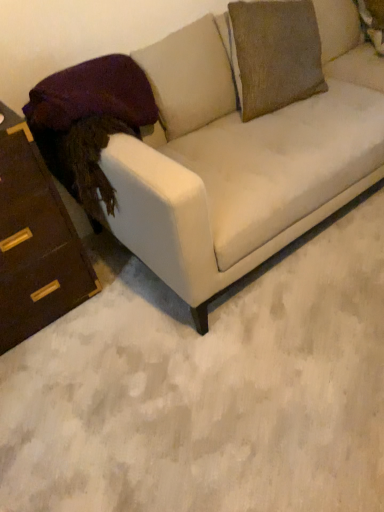
Question: Is velvet purple pillow at left facing towards matte white couch at center?

Choices:
 (A) yes
 (B) no

Answer: (A)

Question: Is velvet purple pillow at left further to the viewer compared to matte white couch at center?

Choices:
 (A) no
 (B) yes

Answer: (B)

Question: Is the surface of velvet purple pillow at left in direct contact with matte white couch at center?

Choices:
 (A) yes
 (B) no

Answer: (B)

Question: Can matte white couch at center be found inside velvet purple pillow at left?

Choices:
 (A) no
 (B) yes

Answer: (A)

Question: Considering the relative sizes of velvet purple pillow at left and matte white couch at center in the image provided, is velvet purple pillow at left thinner than matte white couch at center?

Choices:
 (A) yes
 (B) no

Answer: (A)

Question: Is brown wood chest of drawers at left inside the boundaries of matte white couch at center, or outside?

Choices:
 (A) outside
 (B) inside

Answer: (A)

Question: Considering the positions of brown wood chest of drawers at left and matte white couch at center in the image, is brown wood chest of drawers at left bigger or smaller than matte white couch at center?

Choices:
 (A) big
 (B) small

Answer: (B)

Question: Is point (36, 249) positioned closer to the camera than point (192, 233)?

Choices:
 (A) closer
 (B) farther

Answer: (B)

Question: Visually, is brown wood chest of drawers at left positioned to the left or to the right of matte white couch at center?

Choices:
 (A) right
 (B) left

Answer: (B)

Question: From their relative heights in the image, would you say velvet purple pillow at left is taller or shorter than brown wood chest of drawers at left?

Choices:
 (A) short
 (B) tall

Answer: (A)

Question: In the image, is velvet purple pillow at left positioned in front of or behind brown wood chest of drawers at left?

Choices:
 (A) behind
 (B) front

Answer: (A)

Question: From a real-world perspective, relative to brown wood chest of drawers at left, is velvet purple pillow at left vertically above or below?

Choices:
 (A) above
 (B) below

Answer: (A)

Question: Is velvet purple pillow at left bigger or smaller than brown wood chest of drawers at left?

Choices:
 (A) big
 (B) small

Answer: (B)

Question: From a real-world perspective, is matte white couch at center positioned above or below velvet purple pillow at left?

Choices:
 (A) above
 (B) below

Answer: (B)

Question: Considering the positions of point (226, 179) and point (148, 86), is point (226, 179) closer or farther from the camera than point (148, 86)?

Choices:
 (A) farther
 (B) closer

Answer: (B)